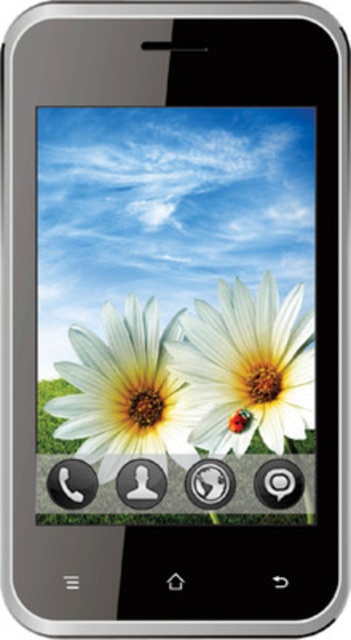
You are holding a smartphone with a screen showing two flowers. The flowers are labeled as the white matte flower at center and the white matte daisy at center. Which one is smaller?

The white matte flower at center is smaller than the white matte daisy at center.